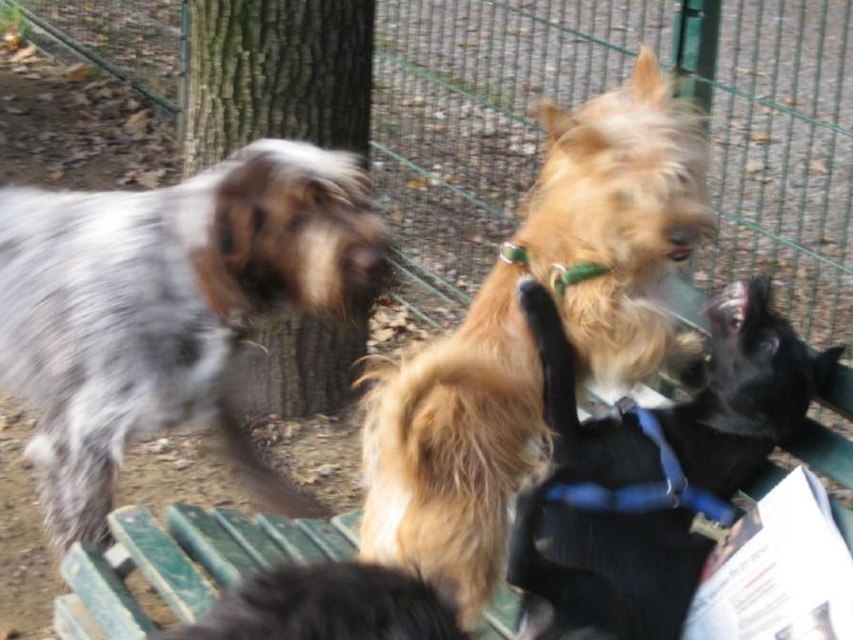
Question: Which of the following is the closest to the observer?

Choices:
 (A) (576, 202)
 (B) (723, 330)
 (C) (82, 451)

Answer: (A)

Question: Does speckled fur dog at left appear on the left side of golden fur dog at center?

Choices:
 (A) yes
 (B) no

Answer: (A)

Question: Is the position of speckled fur dog at left less distant than that of shaggy golden fur at center?

Choices:
 (A) no
 (B) yes

Answer: (A)

Question: Is green wire mesh at upper center wider than golden fur dog at center?

Choices:
 (A) yes
 (B) no

Answer: (A)

Question: Which of the following is the farthest from the observer?

Choices:
 (A) (782, 173)
 (B) (337, 628)
 (C) (413, 403)
 (D) (677, 630)

Answer: (A)

Question: Which is nearer to the green wire mesh at upper center?

Choices:
 (A) shaggy golden fur at center
 (B) black fur dog at center
 (C) speckled fur dog at left

Answer: (C)